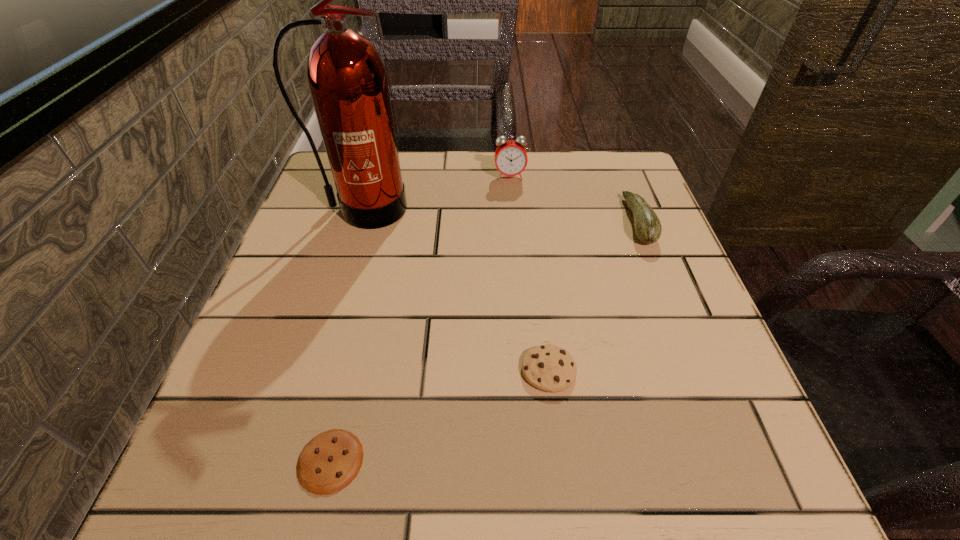
The height and width of the screenshot is (540, 960). Find the location of `fire extinguisher`. fire extinguisher is located at coordinates (347, 79).

Find the location of a particular element. The width and height of the screenshot is (960, 540). the farthest object is located at coordinates (511, 159).

What are the coordinates of `alarm clock` in the screenshot? It's located at (511, 159).

The height and width of the screenshot is (540, 960). Identify the location of the third shortest object. (648, 228).

Locate an element on the screen. This screenshot has width=960, height=540. zucchini is located at coordinates (648, 228).

At what (x,y) coordinates should I click in order to perform the action: click on the right cookie. Please return your answer as a coordinate pair (x, y). Looking at the image, I should click on (550, 368).

Identify the location of the second nearest object. (550, 368).

I want to click on the shorter cookie, so click(x=329, y=462).

In order to click on the nearest object in this screenshot , I will do `click(329, 462)`.

Where is `vacant area situated on the front-facing side of the tallest object`? vacant area situated on the front-facing side of the tallest object is located at coordinates (351, 246).